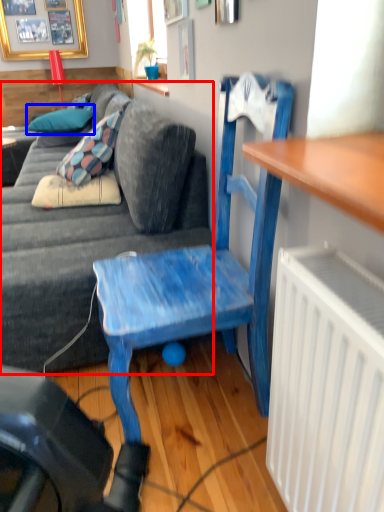
Question: Which of the following is the closest to the observer, studio couch (highlighted by a red box) or pillow (highlighted by a blue box)?

Choices:
 (A) studio couch
 (B) pillow

Answer: (A)